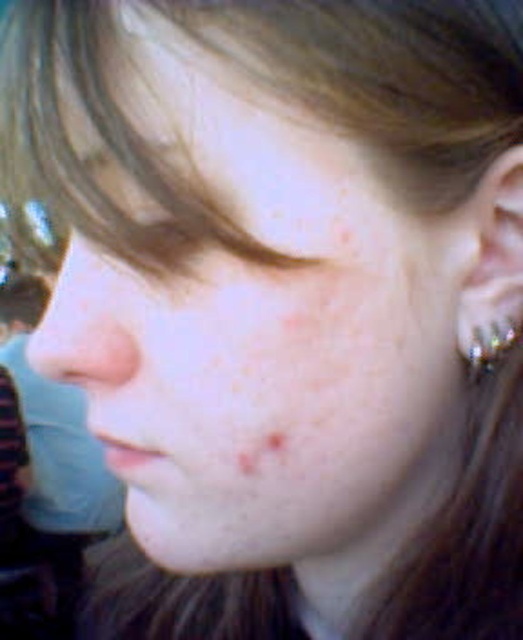
Question: Can you confirm if matte skin nose at center is positioned above silver metallic earring at right?

Choices:
 (A) yes
 (B) no

Answer: (A)

Question: Based on their relative distances, which object is nearer to the brown matte freckle at lower center?

Choices:
 (A) matte skin nose at center
 (B) silver metallic earring at right

Answer: (A)

Question: In this image, where is silver metallic earring at right located relative to brown matte freckle at lower center?

Choices:
 (A) right
 (B) left

Answer: (A)

Question: Is matte skin nose at center further to the viewer compared to brown matte freckle at lower center?

Choices:
 (A) yes
 (B) no

Answer: (B)

Question: Which point is farther to the camera?

Choices:
 (A) silver metallic earring at right
 (B) matte skin nose at center
 (C) brown matte freckle at lower center

Answer: (A)

Question: Among these objects, which one is nearest to the camera?

Choices:
 (A) brown matte freckle at lower center
 (B) silver metallic earring at right
 (C) matte skin nose at center

Answer: (C)